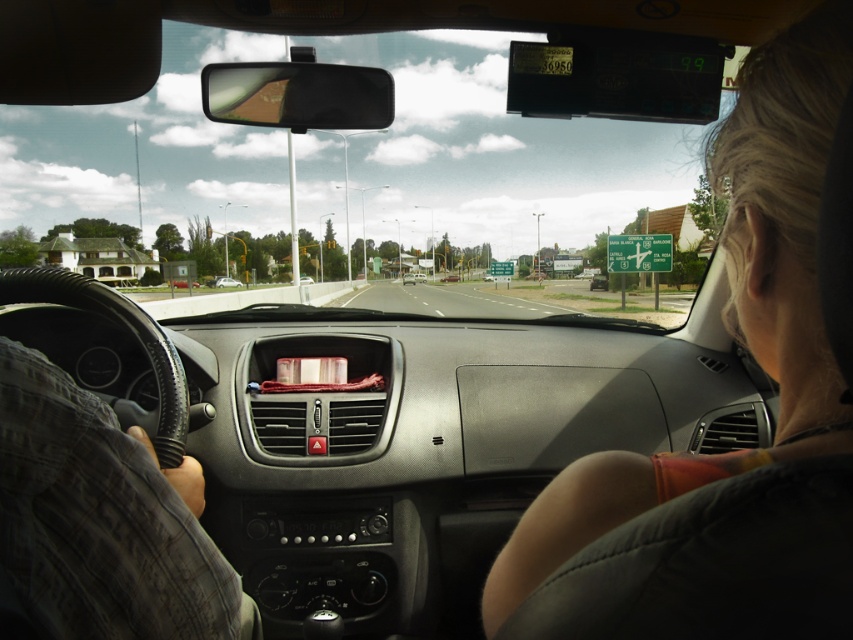
Is transparent glass windshield at center above metallic silver sedan at center?

Yes.

Does point (180, 49) come farther from viewer compared to point (222, 275)?

No, (180, 49) is in front of (222, 275).

You are a GUI agent. You are given a task and a screenshot of the screen. Output one action in this format:
    pyautogui.click(x=<x>, y=<y>)
    Task: Click on the transparent glass windshield at center
    Image resolution: width=853 pixels, height=640 pixels.
    Given the screenshot: What is the action you would take?
    pyautogui.click(x=369, y=186)

Between blonde hair at upper right and metallic silver sedan at center, which one appears on the right side from the viewer's perspective?

blonde hair at upper right is more to the right.

Is blonde hair at upper right below metallic silver sedan at center?

Correct, blonde hair at upper right is located below metallic silver sedan at center.

Which is behind, point (757, 234) or point (236, 280)?

Point (236, 280)

This screenshot has height=640, width=853. What are the coordinates of `blonde hair at upper right` in the screenshot? It's located at (733, 451).

Is point (338, 132) more distant than point (653, 460)?

Yes, point (338, 132) is farther from viewer.

Can you confirm if transparent glass windshield at center is thinner than blonde hair at upper right?

Incorrect, transparent glass windshield at center's width is not less than blonde hair at upper right's.

The height and width of the screenshot is (640, 853). Describe the element at coordinates (369, 186) in the screenshot. I see `transparent glass windshield at center` at that location.

You are a GUI agent. You are given a task and a screenshot of the screen. Output one action in this format:
    pyautogui.click(x=<x>, y=<y>)
    Task: Click on the transparent glass windshield at center
    
    Given the screenshot: What is the action you would take?
    pyautogui.click(x=369, y=186)